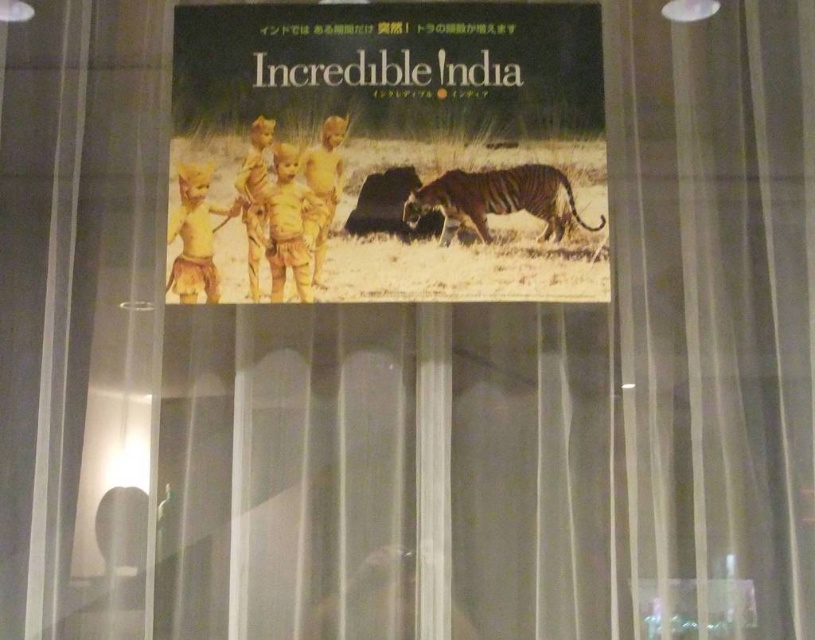
Does point (391, 124) lie behind point (448, 189)?

Yes.

Is point (510, 188) less distant than point (597, 228)?

No, it is not.

The width and height of the screenshot is (815, 640). Find the location of `matte yellow poster at center`. matte yellow poster at center is located at coordinates (390, 150).